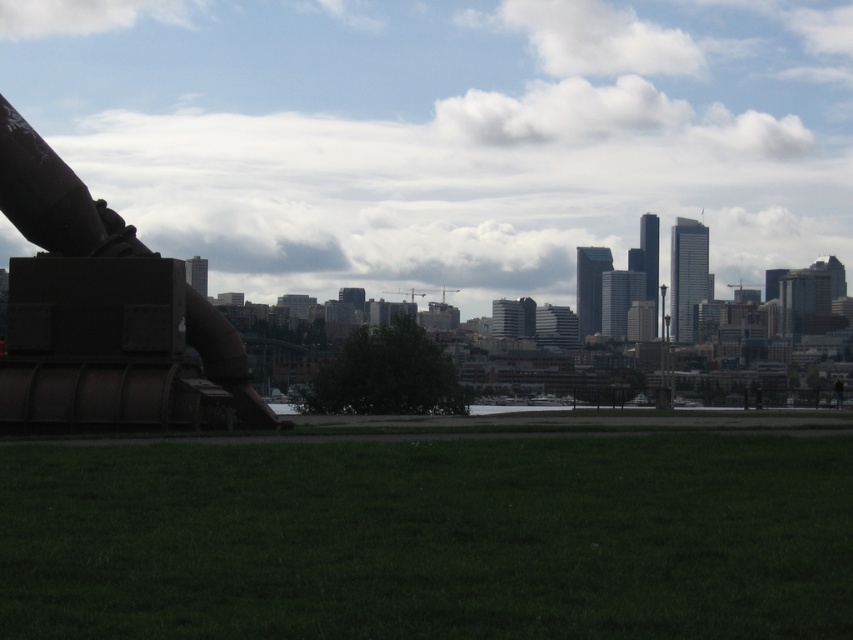
Who is positioned more to the right, green grass at lower center or rusty metal cannon at left?

From the viewer's perspective, green grass at lower center appears more on the right side.

What are the coordinates of `green grass at lower center` in the screenshot? It's located at (430, 538).

This screenshot has height=640, width=853. I want to click on green grass at lower center, so click(x=430, y=538).